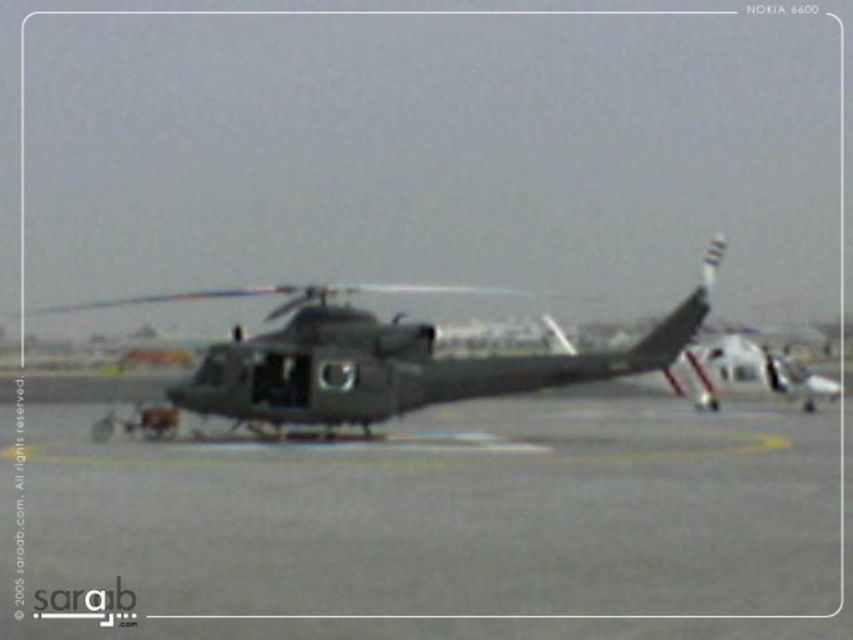
Question: Is gray asphalt tarmac at center wider than dark gray matte helicopter at center?

Choices:
 (A) no
 (B) yes

Answer: (A)

Question: Considering the relative positions of gray asphalt tarmac at center and dark gray matte helicopter at center in the image provided, where is gray asphalt tarmac at center located with respect to dark gray matte helicopter at center?

Choices:
 (A) right
 (B) left

Answer: (A)

Question: Which of the following is the farthest from the observer?

Choices:
 (A) click(x=325, y=604)
 (B) click(x=337, y=316)

Answer: (B)

Question: Is gray asphalt tarmac at center to the left of dark gray matte helicopter at center from the viewer's perspective?

Choices:
 (A) yes
 (B) no

Answer: (B)